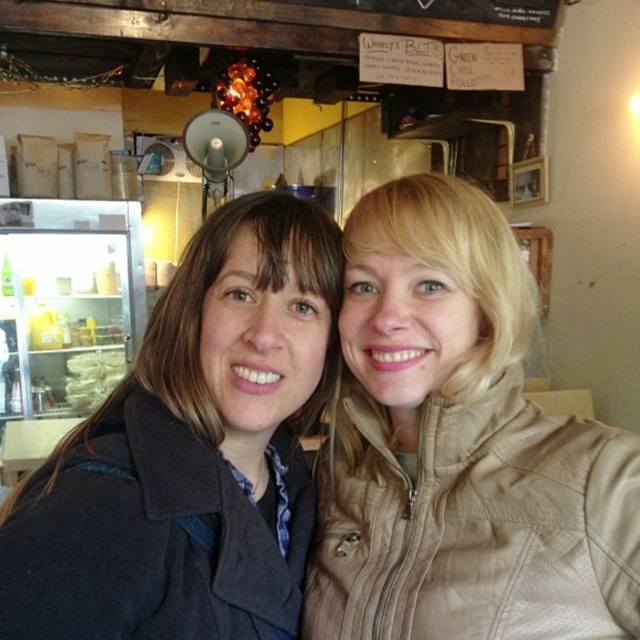
You are standing at the point marked as point [480,394] in the image and want to take a selfie with your friend who is at the viewer position. If your camera has a maximum focus range of 25 inches, will you be able to capture both of you clearly in the photo?

The distance between point [480,394] and the viewer is 26.22 inches, which exceeds the camera maximum focus range of 25 inches. Therefore, you won not be able to capture both of you clearly in the photo.

You are standing in a cozy rustic cafe and see two coats hanging on a rack in the background. The tan leather jacket at center and the dark blue wool coat at center. Which coat is closer to you?

The tan leather jacket at center is closer to you because it is further to the viewer than the dark blue wool coat at center.